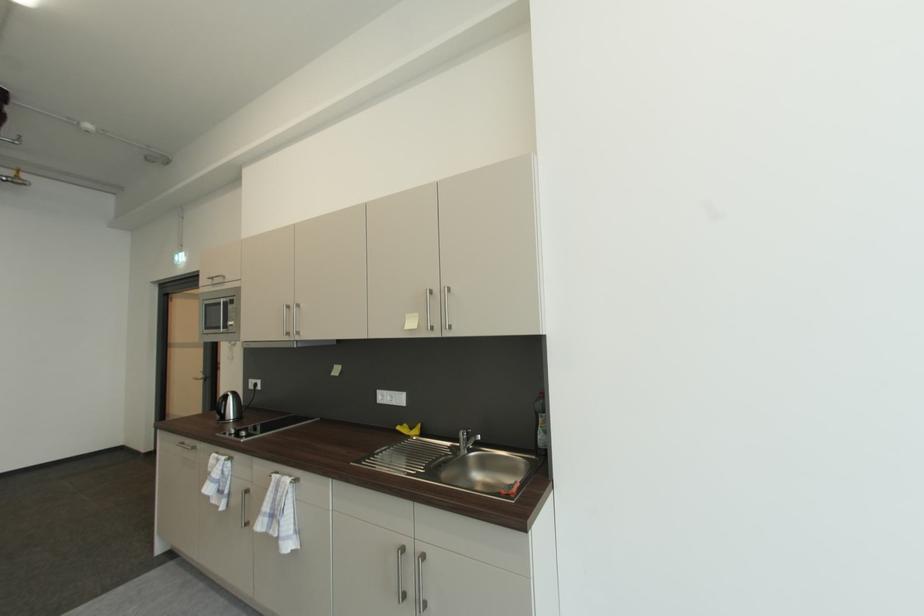
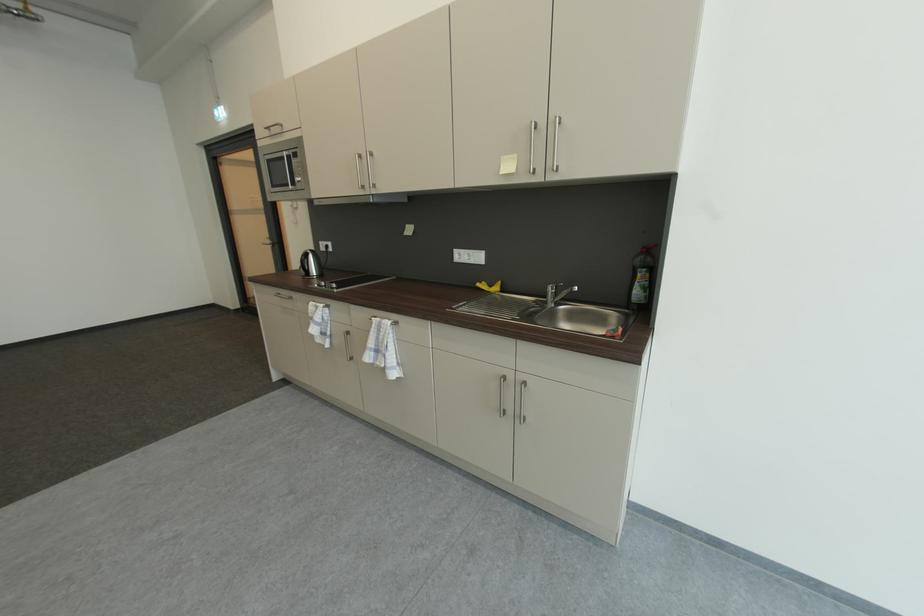
Locate, in the second image, the point that corresponds to (408,427) in the first image.

(487, 284)